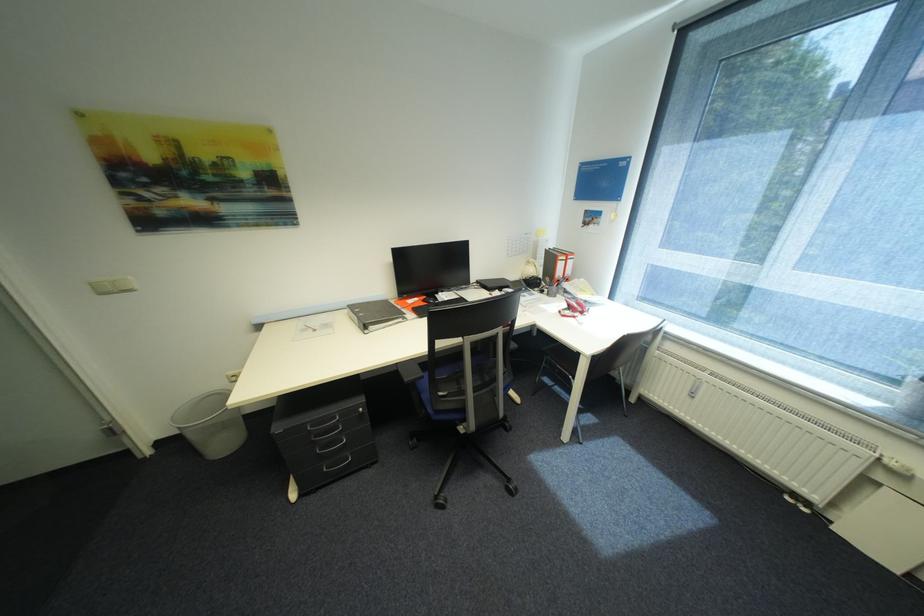
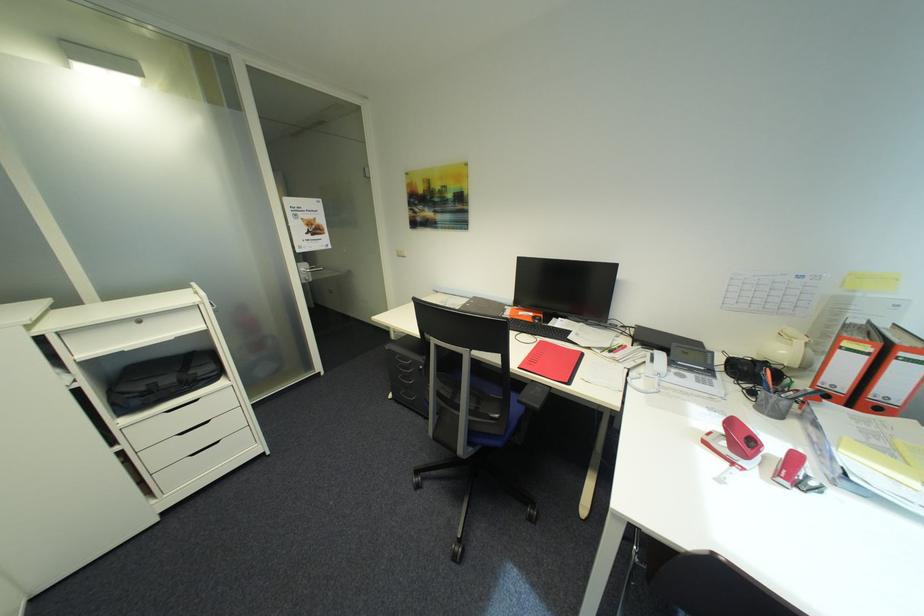
Find the pixel in the second image that matches point 572,262 in the first image.

(872, 359)